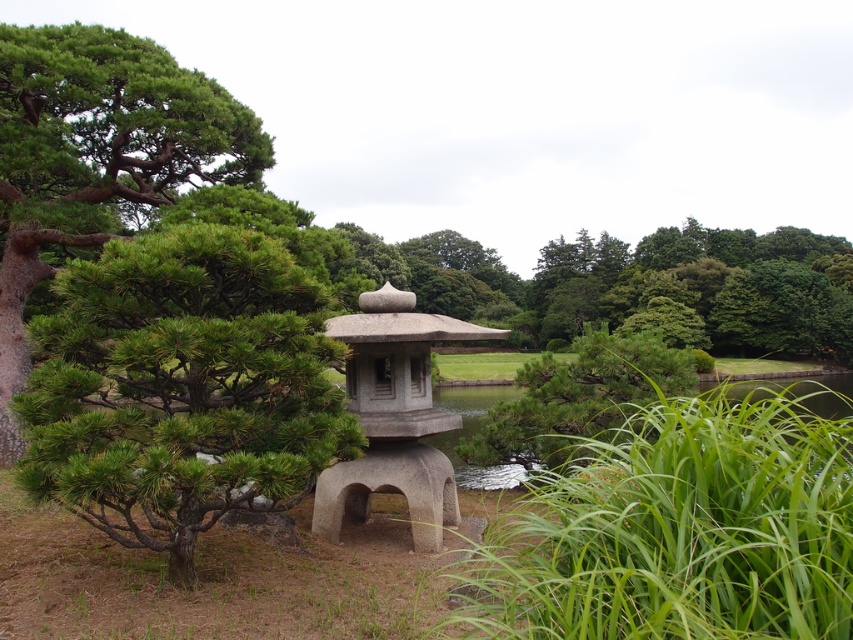
You are a visitor in the Japanese garden and want to take a photo of the green textured stone tree at left and the gray stone gazebo at center. Which object should you frame first in your camera viewfinder to ensure both are in the shot?

The green textured stone tree at left is positioned on the left side of gray stone gazebo at center, so you should frame the gray stone gazebo at center first and then adjust to include the green textured stone tree at left in the shot.

You are a visitor in the Japanese garden and want to take a photo of the green textured pine tree at left and the gray stone gazebo at center. Which object should you frame first in your camera viewfinder to ensure both are in the shot?

The green textured pine tree at left is to the left of gray stone gazebo at center, so you should frame the green textured pine tree at left first to ensure both are in the shot.

You are a visitor in the Japanese garden and want to take a photo of the green textured stone tree at left and the green textured pine tree at left. From your current position, which one is positioned lower in the frame?

The green textured stone tree at left is located below the green textured pine tree at left, so the green textured stone tree at left is positioned lower in the frame.